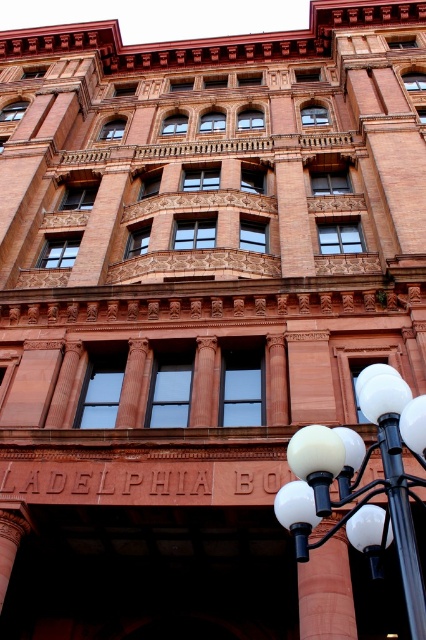
Question: Which point is closer to the camera?

Choices:
 (A) white glass street light at lower right
 (B) black metal pole at lower right

Answer: (B)

Question: In this image, where is white glass street light at lower right located relative to black metal pole at lower right?

Choices:
 (A) right
 (B) left

Answer: (B)

Question: Which object appears closest to the camera in this image?

Choices:
 (A) white glass street light at lower right
 (B) black metal pole at lower right

Answer: (B)

Question: Does white glass street light at lower right have a lesser width compared to black metal pole at lower right?

Choices:
 (A) no
 (B) yes

Answer: (A)

Question: Is white glass street light at lower right wider than black metal pole at lower right?

Choices:
 (A) no
 (B) yes

Answer: (B)